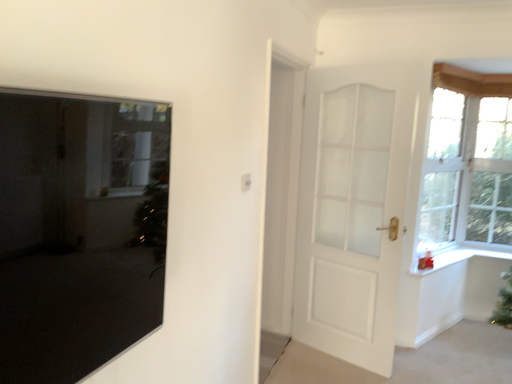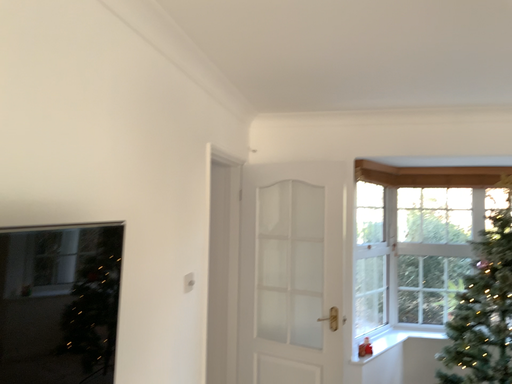
Question: Which way did the camera rotate in the video?

Choices:
 (A) rotated right
 (B) rotated left

Answer: (A)